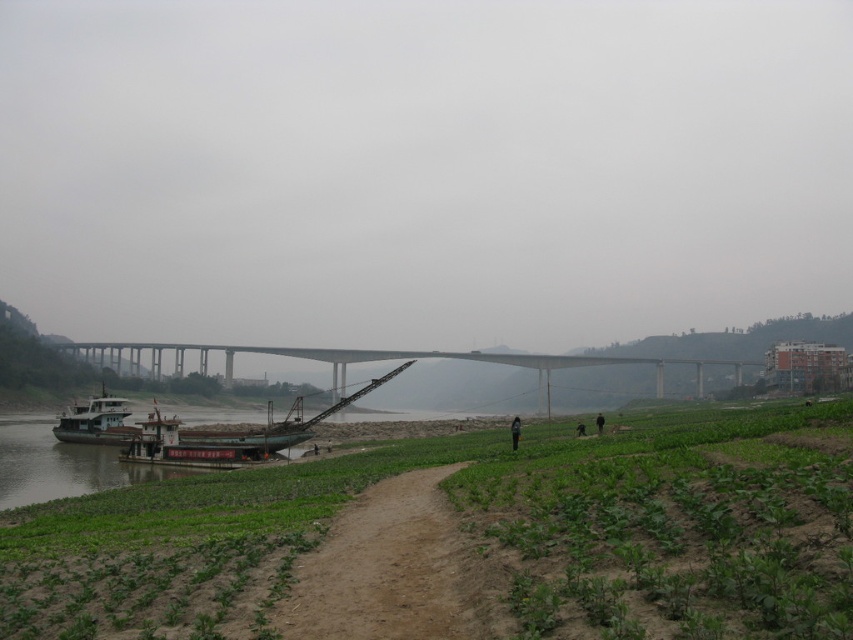
Between point (416, 493) and point (519, 420), which one is positioned in front?

Point (416, 493) is more forward.

Between dirt path at center and black fabric person at lower center, which one is positioned higher?

Positioned higher is dirt path at center.

Is point (390, 589) less distant than point (514, 426)?

Yes, point (390, 589) is in front of point (514, 426).

Where is `dirt path at center`? Image resolution: width=853 pixels, height=640 pixels. dirt path at center is located at coordinates (389, 570).

Does green leafy plants at lower left appear over brown wooden barge at lower left?

Yes.

Who is more forward, [82,624] or [119,444]?

Positioned in front is point [82,624].

This screenshot has width=853, height=640. Find the location of `green leafy plants at lower left`. green leafy plants at lower left is located at coordinates (485, 532).

Looking at this image, does white matte boat at left appear over black fabric person at lower center?

No.

Find the location of `white matte boat at left`. white matte boat at left is located at coordinates (96, 420).

Where is `white matte boat at left`? The width and height of the screenshot is (853, 640). white matte boat at left is located at coordinates (96, 420).